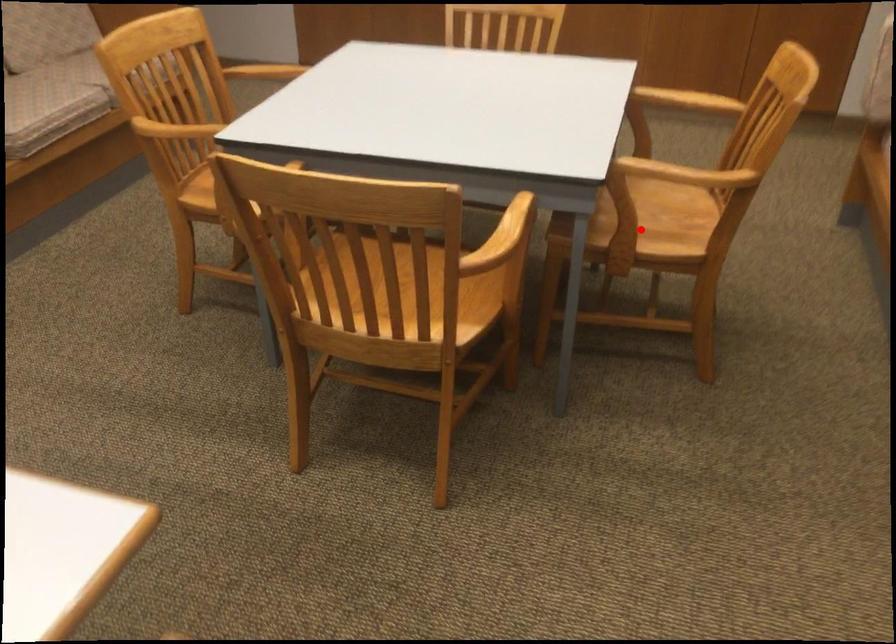
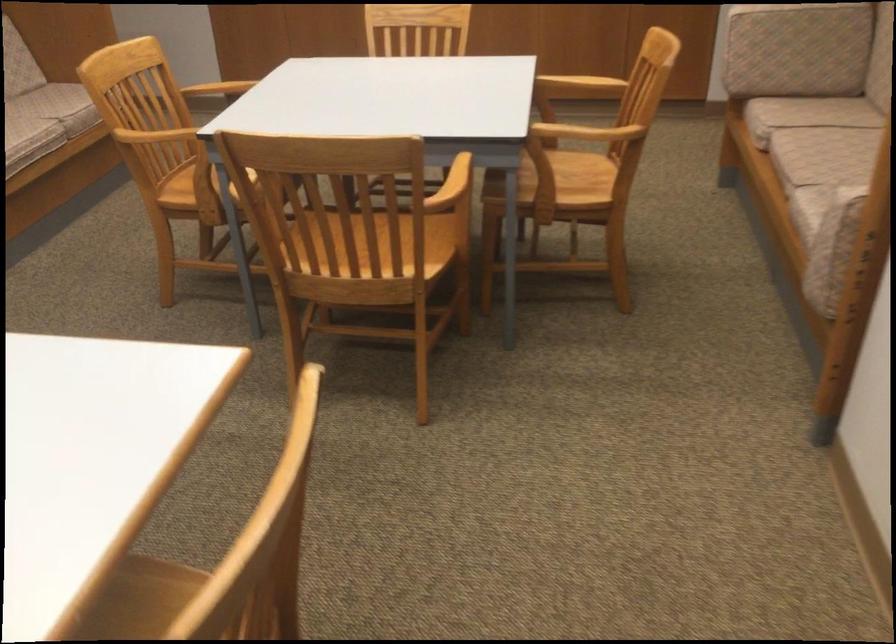
Where in the second image is the point corresponding to the highlighted location from the first image?

(556, 182)